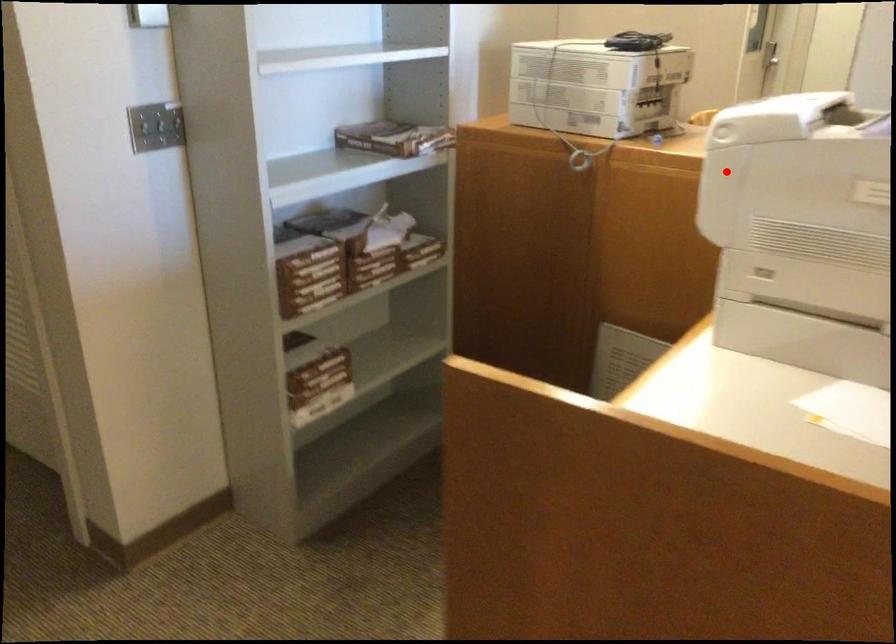
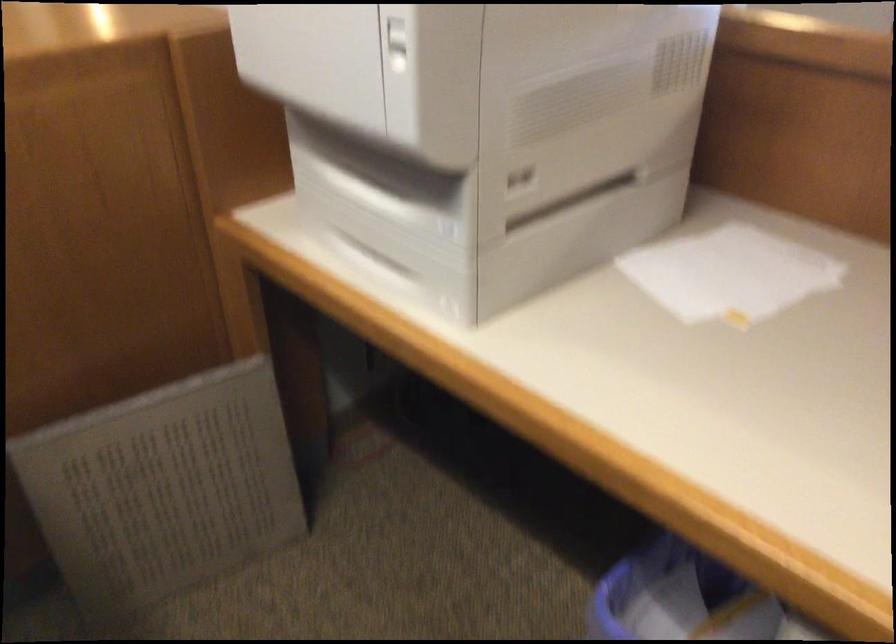
The point at the highlighted location is marked in the first image. Where is the corresponding point in the second image?

(397, 44)